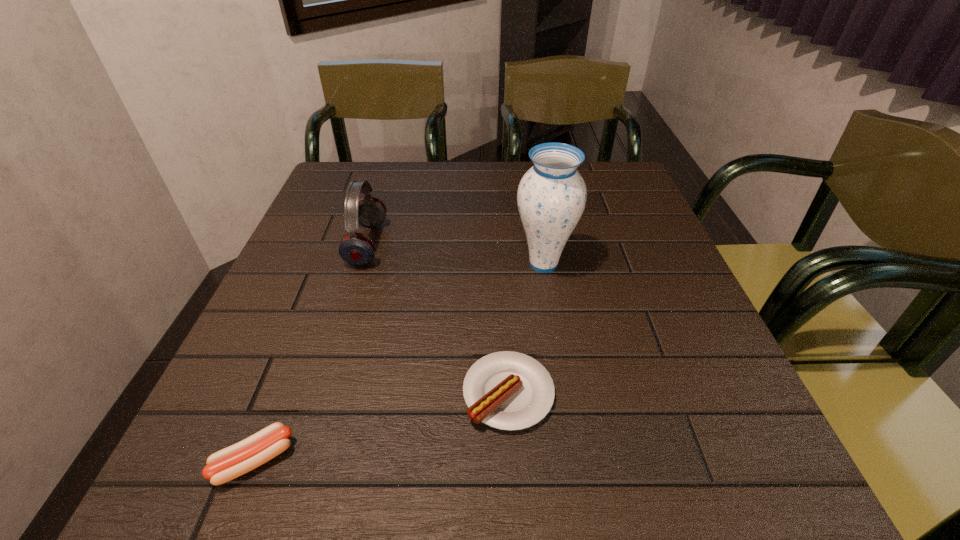
You are a GUI agent. You are given a task and a screenshot of the screen. Output one action in this format:
    pyautogui.click(x=<x>, y=<y>)
    Task: Click on the closest object to the right sausage
    The height and width of the screenshot is (540, 960).
    Given the screenshot: What is the action you would take?
    551,197

You are a GUI agent. You are given a task and a screenshot of the screen. Output one action in this format:
    pyautogui.click(x=<x>, y=<y>)
    Task: Click on the vacant region that satisfies the following two spatial constraints: 1. on the back side of the right sausage; 2. on the left side of the vase
    The image size is (960, 540).
    Given the screenshot: What is the action you would take?
    pyautogui.click(x=501, y=264)

Where is `free location that satisfies the following two spatial constraints: 1. on the ear cups of the second tallest object; 2. on the right side of the vase`? This screenshot has width=960, height=540. free location that satisfies the following two spatial constraints: 1. on the ear cups of the second tallest object; 2. on the right side of the vase is located at coordinates (361, 264).

Where is `vacant region that satisfies the following two spatial constraints: 1. on the ear cups of the right sausage; 2. on the left side of the second tallest object`? vacant region that satisfies the following two spatial constraints: 1. on the ear cups of the right sausage; 2. on the left side of the second tallest object is located at coordinates (321, 393).

What are the coordinates of `vacant space that satisfies the following two spatial constraints: 1. on the back side of the right sausage; 2. on the ear cups of the third shortest object` in the screenshot? It's located at (500, 244).

Where is `free location that satisfies the following two spatial constraints: 1. on the ear cups of the second tallest object; 2. on the back side of the right sausage`? free location that satisfies the following two spatial constraints: 1. on the ear cups of the second tallest object; 2. on the back side of the right sausage is located at coordinates (321, 393).

At what (x,y) coordinates should I click in order to perform the action: click on vacant region that satisfies the following two spatial constraints: 1. on the back side of the vase; 2. on the ear cups of the second tallest object. Please return your answer as a coordinate pair (x, y). This screenshot has width=960, height=540. Looking at the image, I should click on (540, 244).

The image size is (960, 540). What are the coordinates of `vacant space that satisfies the following two spatial constraints: 1. on the ear cups of the second tallest object; 2. on the back side of the tallest object` in the screenshot? It's located at (361, 264).

Locate an element on the screen. The height and width of the screenshot is (540, 960). free space that satisfies the following two spatial constraints: 1. on the ear cups of the earphone; 2. on the back side of the tallest object is located at coordinates (361, 264).

This screenshot has height=540, width=960. Identify the location of vacant position in the image that satisfies the following two spatial constraints: 1. on the ear cups of the second tallest object; 2. on the left side of the right sausage. (321, 393).